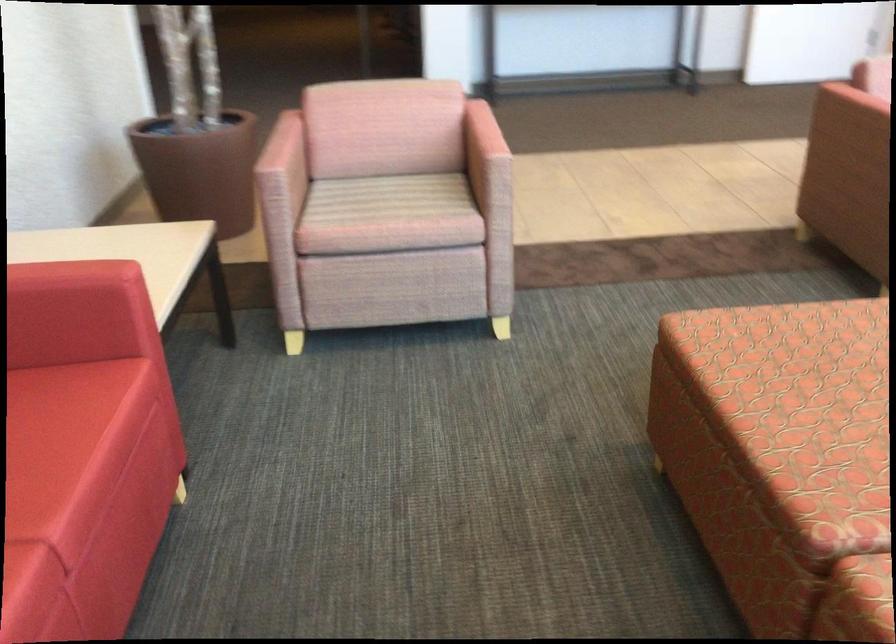
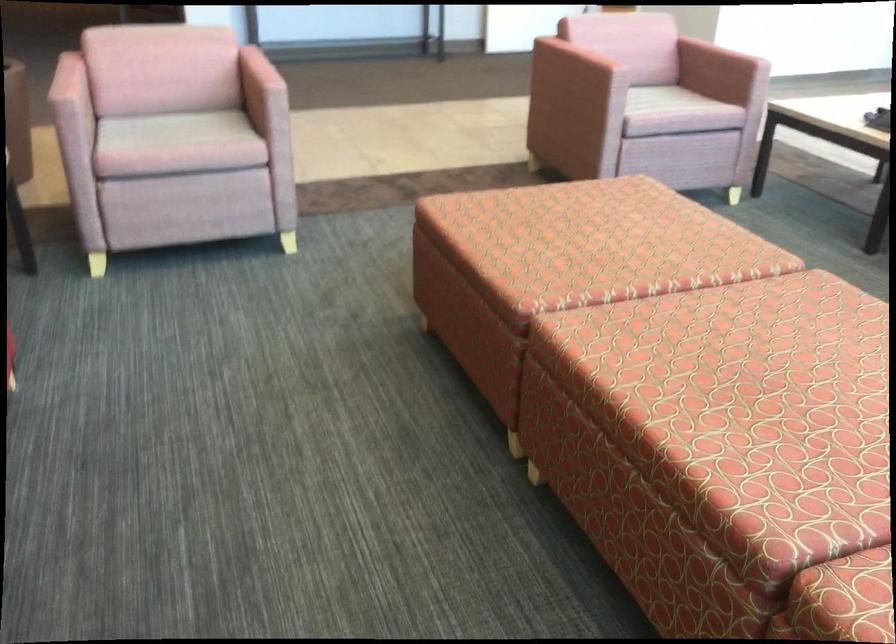
Question: The camera is either moving clockwise (left) or counter-clockwise (right) around the object. The first image is from the beginning of the video and the second image is from the end. Is the camera moving left or right when shooting the video?

Choices:
 (A) Left
 (B) Right

Answer: (A)